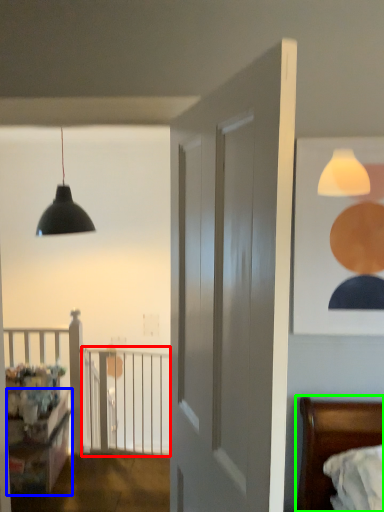
Question: Which object is positioned closest to balustrade (highlighted by a red box)? Select from dresser (highlighted by a blue box) and bed (highlighted by a green box).

Choices:
 (A) dresser
 (B) bed

Answer: (A)